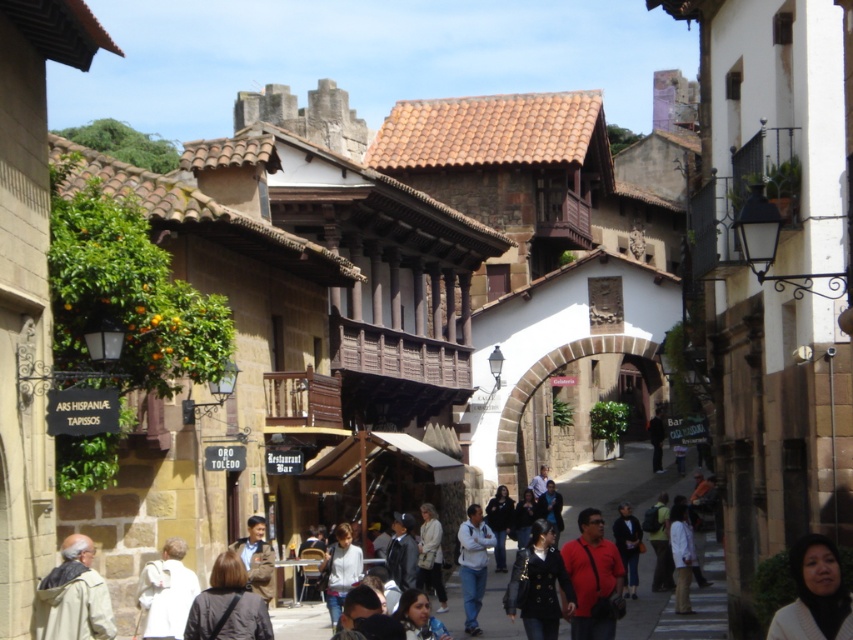
Consider the image. You are a tourist walking along the historic street and notice two jackets hanging on a rack in the middle of the scene. Which jacket is nearer to you, the black leather jacket at center or the dark blue jacket at center?

The black leather jacket at center is closer to the viewer than the dark blue jacket at center, so the black leather jacket at center is nearer to you.

You are a tourist standing on the street in front of the historic buildings. You see a denim jeans at center and a light beige sweater at center. Which item is positioned higher up in the scene?

The denim jeans at center is located above the light beige sweater at center, so it is positioned higher up in the scene.